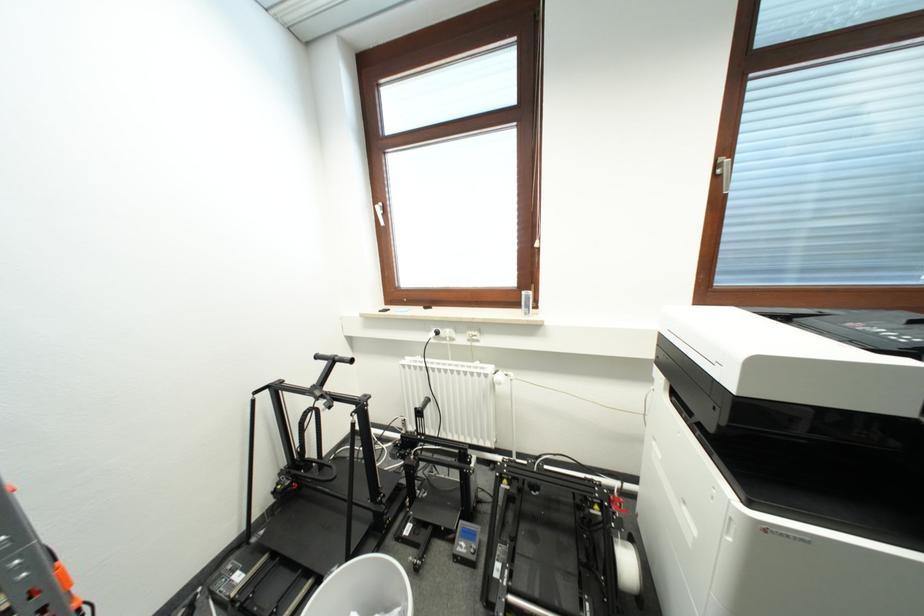
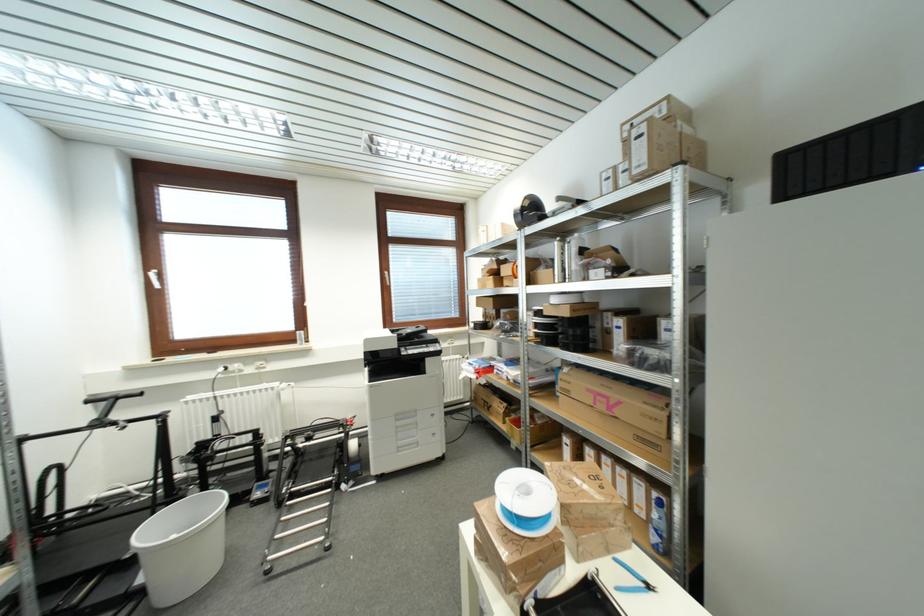
Find the pixel in the second image that matches (379,206) in the first image.

(151, 273)